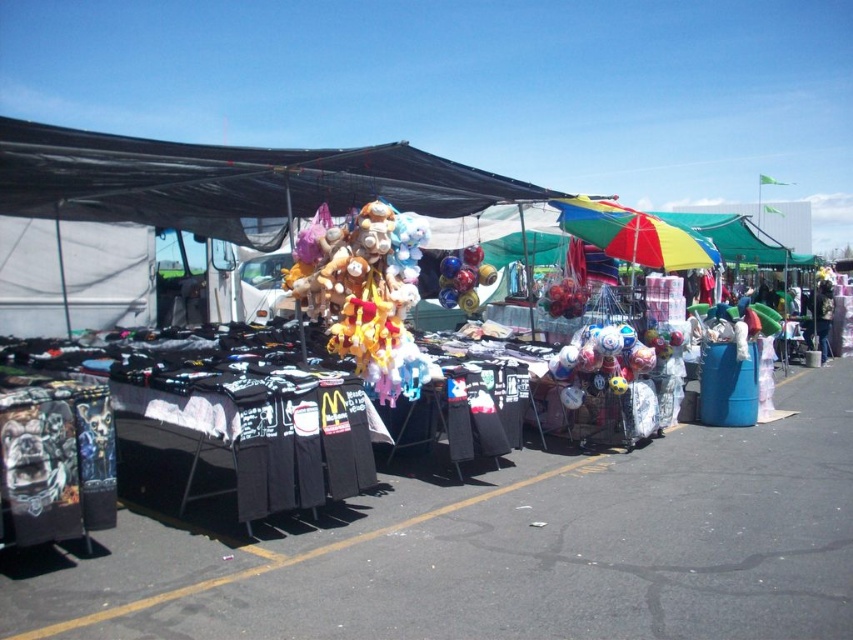
Question: Does black fabric t-shirts at center have a greater width compared to fluffy plush at center?

Choices:
 (A) yes
 (B) no

Answer: (B)

Question: Does fluffy plush toys at center appear over rainbow fabric umbrella at center?

Choices:
 (A) yes
 (B) no

Answer: (B)

Question: Among these objects, which one is nearest to the camera?

Choices:
 (A) black fabric t-shirts at center
 (B) fluffy plush at center

Answer: (A)

Question: Is rainbow fabric umbrella at center bigger than fluffy plush at center?

Choices:
 (A) yes
 (B) no

Answer: (A)

Question: Estimate the real-world distances between objects in this image. Which object is farther from the black fabric t-shirts at center?

Choices:
 (A) fluffy plush toys at center
 (B) fluffy plush at center
 (C) rainbow fabric umbrella at center

Answer: (B)

Question: Which point is farther to the camera?

Choices:
 (A) (666, 220)
 (B) (198, 216)
 (C) (370, 340)

Answer: (A)